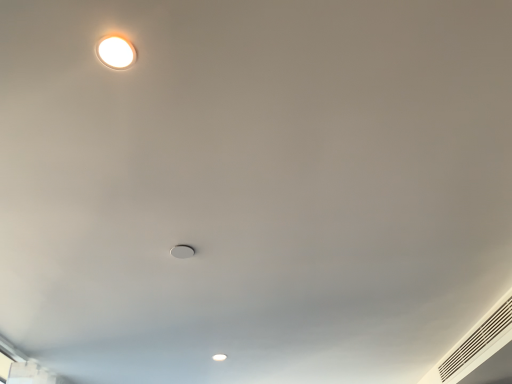
Question: Is matte white lamp at upper left taller or shorter than white textured vent at lower right?

Choices:
 (A) tall
 (B) short

Answer: (B)

Question: Is point (112, 49) closer or farther from the camera than point (461, 367)?

Choices:
 (A) closer
 (B) farther

Answer: (A)

Question: Is matte white lamp at upper left in front of or behind white textured vent at lower right in the image?

Choices:
 (A) front
 (B) behind

Answer: (A)

Question: Looking at the image, does white textured vent at lower right seem bigger or smaller compared to matte white lamp at upper left?

Choices:
 (A) big
 (B) small

Answer: (A)

Question: From the image's perspective, is white textured vent at lower right above or below matte white lamp at upper left?

Choices:
 (A) above
 (B) below

Answer: (B)

Question: Visually, is white textured vent at lower right positioned to the left or to the right of matte white lamp at upper left?

Choices:
 (A) right
 (B) left

Answer: (A)

Question: From a real-world perspective, is white textured vent at lower right positioned above or below matte white lamp at upper left?

Choices:
 (A) above
 (B) below

Answer: (B)